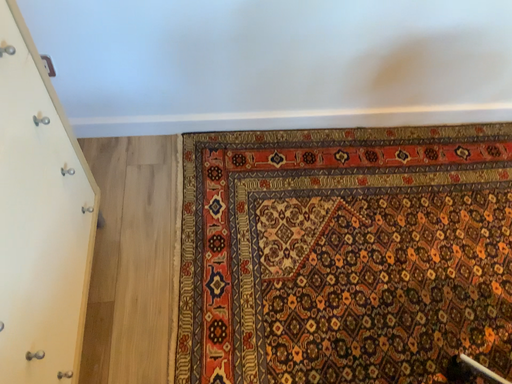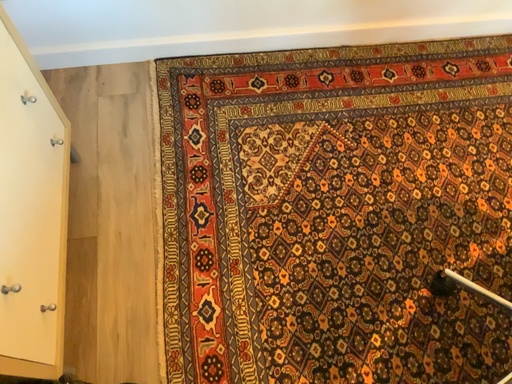
Question: How did the camera likely rotate when shooting the video?

Choices:
 (A) rotated upward
 (B) rotated downward

Answer: (B)